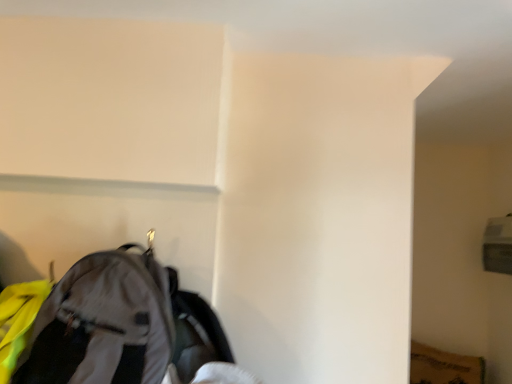
Describe the element at coordinates (120, 325) in the screenshot. I see `matte gray backpack at lower left` at that location.

Where is `matte gray backpack at lower left`? This screenshot has height=384, width=512. matte gray backpack at lower left is located at coordinates (x=120, y=325).

This screenshot has height=384, width=512. Identify the location of matte gray backpack at lower left. (120, 325).